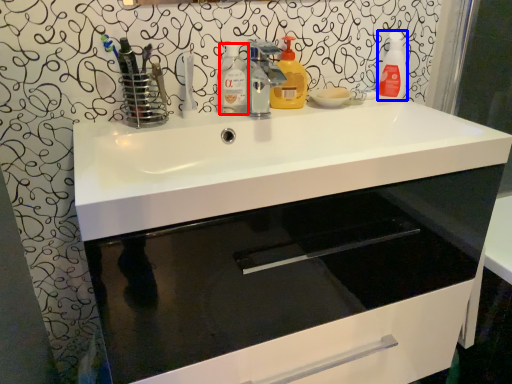
Question: Which point is further to the camera, cleaning product (highlighted by a red box) or cleaning product (highlighted by a blue box)?

Choices:
 (A) cleaning product
 (B) cleaning product

Answer: (B)